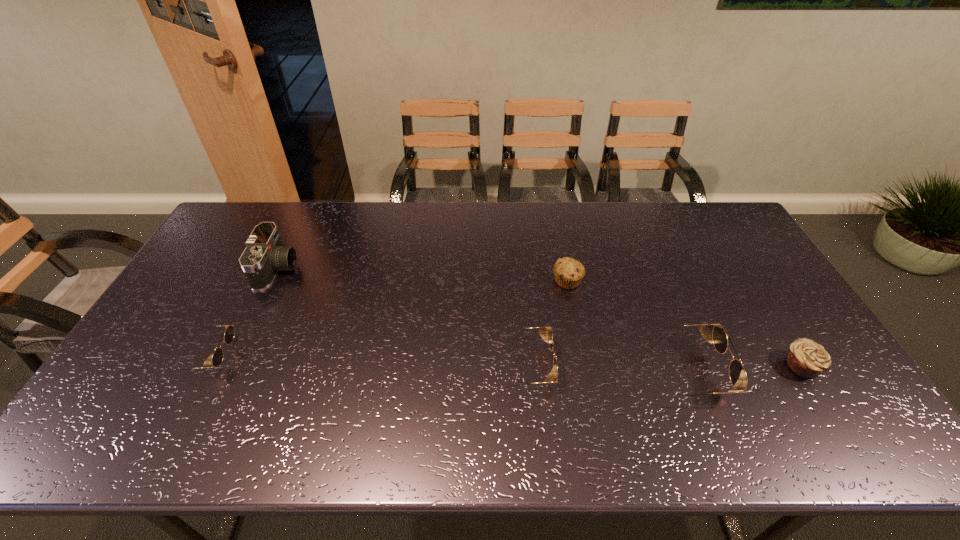
Find the location of a particular element. The width and height of the screenshot is (960, 540). blank space at the far edge is located at coordinates tap(576, 233).

This screenshot has height=540, width=960. Find the location of `free space at the near edge of the desktop`. free space at the near edge of the desktop is located at coordinates (261, 389).

The height and width of the screenshot is (540, 960). Find the location of `vacant area at the left edge`. vacant area at the left edge is located at coordinates coord(230,291).

In the image, there is a desktop. At what (x,y) coordinates should I click in order to perform the action: click on free region at the right edge. Please return your answer as a coordinate pair (x, y). Image resolution: width=960 pixels, height=540 pixels. Looking at the image, I should click on (745, 269).

In the image, there is a desktop. Where is `free region at the near left corner`? The height and width of the screenshot is (540, 960). free region at the near left corner is located at coordinates pos(129,387).

You are a GUI agent. You are given a task and a screenshot of the screen. Output one action in this format:
    pyautogui.click(x=<x>, y=<y>)
    Task: Click on the free space at the far right corner
    This screenshot has height=540, width=960.
    Given the screenshot: What is the action you would take?
    pyautogui.click(x=722, y=230)

You are a GUI agent. You are given a task and a screenshot of the screen. Output one action in this format:
    pyautogui.click(x=<x>, y=<y>)
    Task: Click on the free area in between the second shortest sunglasses and the farther muffin
    Image resolution: width=960 pixels, height=540 pixels.
    Given the screenshot: What is the action you would take?
    pyautogui.click(x=545, y=323)

This screenshot has width=960, height=540. What are the coordinates of `unoccupied area between the second object from right to left and the left muffin` in the screenshot? It's located at (626, 326).

The image size is (960, 540). What are the coordinates of `unoccupied position between the rightmost object and the farther muffin` in the screenshot? It's located at (684, 323).

Identify the location of empty location between the tallest sunglasses and the third object from right to left. (626, 326).